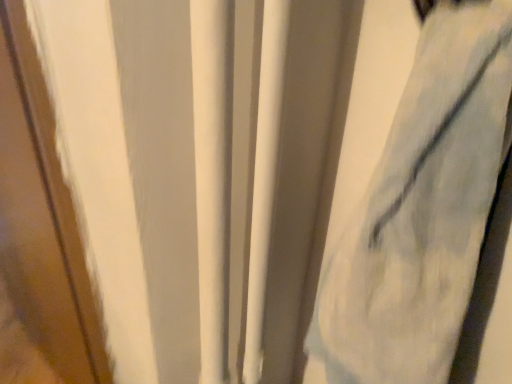
Consider the image. In order to face white fabric at right, should I rotate leftwards or rightwards?

Rotate right and turn 18.861 degrees.

Describe the element at coordinates (421, 211) in the screenshot. The width and height of the screenshot is (512, 384). I see `white fabric at right` at that location.

You are a GUI agent. You are given a task and a screenshot of the screen. Output one action in this format:
    pyautogui.click(x=<x>, y=<y>)
    Task: Click on the white fabric at right
    
    Given the screenshot: What is the action you would take?
    pyautogui.click(x=421, y=211)

Locate an element on the screen. This screenshot has width=512, height=384. white fabric at right is located at coordinates (421, 211).